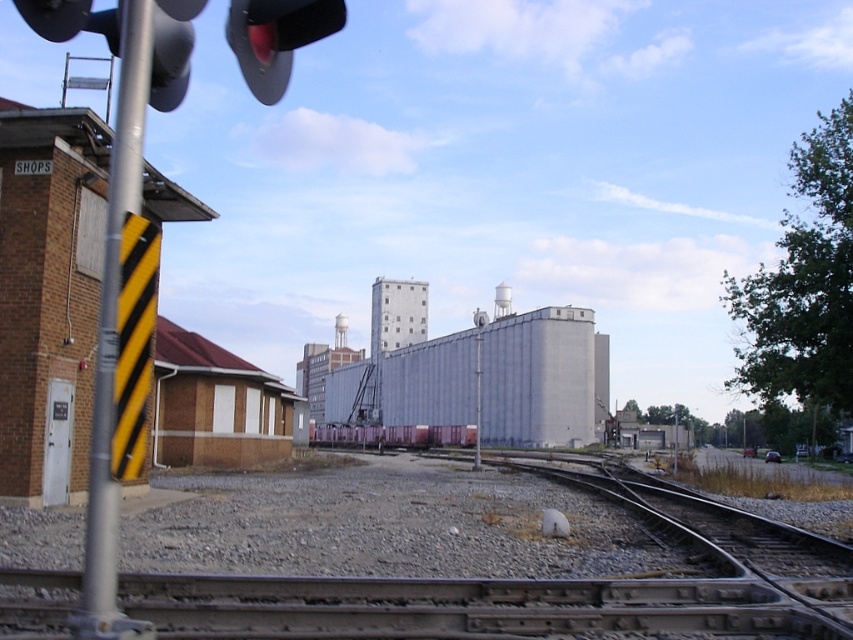
Can you confirm if smooth metal train track at center is positioned below metallic pink train car at center?

Incorrect, smooth metal train track at center is not positioned below metallic pink train car at center.

The height and width of the screenshot is (640, 853). What do you see at coordinates (477, 557) in the screenshot?
I see `smooth metal train track at center` at bounding box center [477, 557].

Which is in front, point (329, 538) or point (448, 433)?

Point (329, 538) is more forward.

Identify the location of smooth metal train track at center. The image size is (853, 640). (477, 557).

Consider the image. Does metal/yellow/black sign at left come in front of black matte traffic light at upper center?

That is True.

Which is behind, point (100, 620) or point (252, 93)?

Positioned behind is point (252, 93).

Measure the distance between point [142,10] and camera.

A distance of 3.38 meters exists between point [142,10] and camera.

At what (x,y) coordinates should I click in order to perform the action: click on metal/yellow/black sign at left. Please return your answer as a coordinate pair (x, y). This screenshot has height=640, width=853. Looking at the image, I should click on (114, 340).

In the scene shown: Does metal/yellow/black sign at left lie behind metallic pink train car at center?

No, it is not.

Does metal/yellow/black sign at left appear on the right side of metallic pink train car at center?

Indeed, metal/yellow/black sign at left is positioned on the right side of metallic pink train car at center.

Describe the element at coordinates (114, 340) in the screenshot. The height and width of the screenshot is (640, 853). I see `metal/yellow/black sign at left` at that location.

Locate an element on the screen. This screenshot has width=853, height=640. metal/yellow/black sign at left is located at coordinates (114, 340).